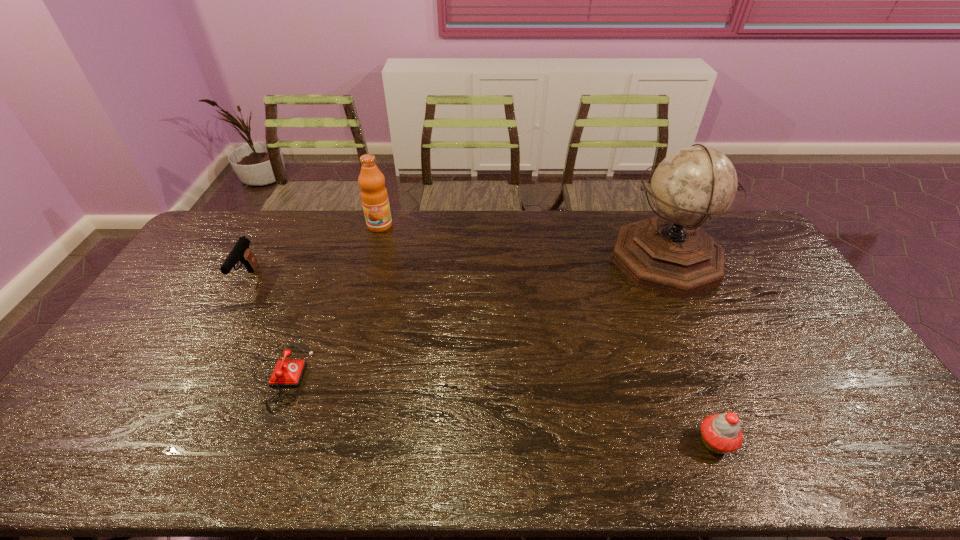
Locate an element on the screen. The width and height of the screenshot is (960, 540). vacant space in between the leftmost object and the globe is located at coordinates (457, 269).

This screenshot has height=540, width=960. I want to click on the third closest object to the fourth farthest object, so click(x=670, y=254).

The width and height of the screenshot is (960, 540). Find the location of `the closest object to the tallest object`. the closest object to the tallest object is located at coordinates (720, 433).

The height and width of the screenshot is (540, 960). I want to click on vacant space that satisfies the following two spatial constraints: 1. on the label side of the second tallest object; 2. on the dial of the shortest object, so click(338, 376).

This screenshot has width=960, height=540. Find the location of `free space that satisfies the following two spatial constraints: 1. on the dial of the shortest object; 2. on the right side of the cupcake`. free space that satisfies the following two spatial constraints: 1. on the dial of the shortest object; 2. on the right side of the cupcake is located at coordinates (251, 442).

This screenshot has width=960, height=540. Identify the location of vacant position in the image that satisfies the following two spatial constraints: 1. on the surface of the tallest object; 2. at the barrel of the leftmost object. (675, 279).

Identify the location of free space that satisfies the following two spatial constraints: 1. on the label side of the fruit juice; 2. on the dial of the shortest object. The height and width of the screenshot is (540, 960). (338, 376).

The height and width of the screenshot is (540, 960). In order to click on vacant space that satisfies the following two spatial constraints: 1. on the label side of the fruit juice; 2. on the dial of the fourth farthest object in this screenshot , I will do `click(338, 376)`.

Image resolution: width=960 pixels, height=540 pixels. Find the location of `blank space that satisfies the following two spatial constraints: 1. on the dial of the second nearest object; 2. on the left side of the nearest object`. blank space that satisfies the following two spatial constraints: 1. on the dial of the second nearest object; 2. on the left side of the nearest object is located at coordinates (251, 442).